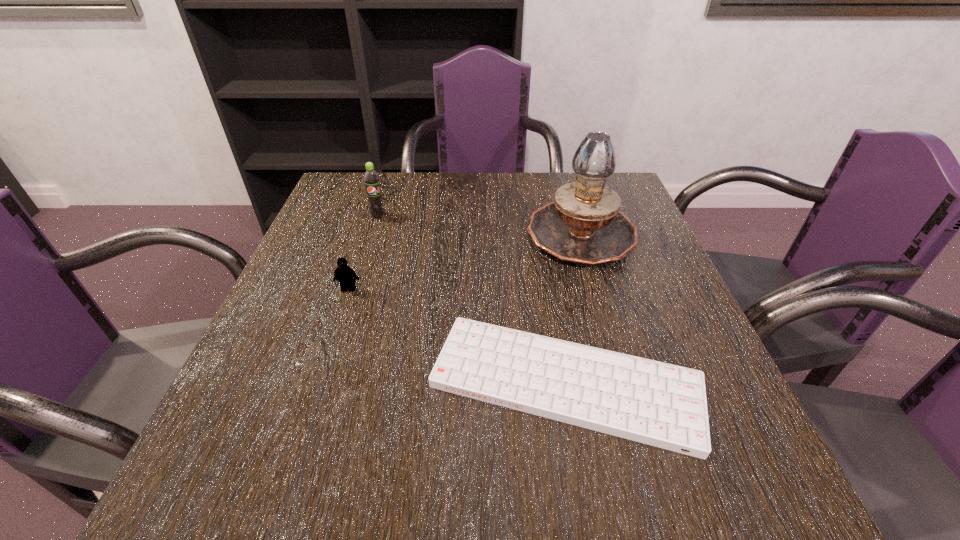
I want to click on vacant space at the far edge of the desktop, so click(x=476, y=179).

I want to click on vacant space at the left edge of the desktop, so click(x=297, y=326).

Where is `vacant space at the right edge of the desktop`? vacant space at the right edge of the desktop is located at coordinates (678, 293).

In the image, there is a desktop. In order to click on free space at the near left corner in this screenshot , I will do point(280,490).

Image resolution: width=960 pixels, height=540 pixels. I want to click on vacant space at the far right corner, so click(621, 180).

The height and width of the screenshot is (540, 960). In order to click on free space between the shortest object and the soda in this screenshot , I will do `click(471, 299)`.

Image resolution: width=960 pixels, height=540 pixels. In order to click on empty space between the tallest object and the nearest object in this screenshot , I will do (573, 308).

In order to click on vacant area that lies between the third shortest object and the nearest object in this screenshot , I will do `click(471, 299)`.

This screenshot has width=960, height=540. What are the coordinates of `free spot between the third shortest object and the Lego` in the screenshot? It's located at (364, 252).

This screenshot has height=540, width=960. I want to click on free spot between the third shortest object and the shortest object, so click(x=471, y=299).